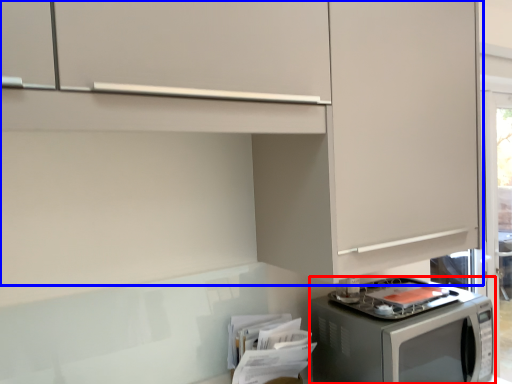
Question: Which object is further to the camera taking this photo, home appliance (highlighted by a red box) or cabinetry (highlighted by a blue box)?

Choices:
 (A) home appliance
 (B) cabinetry

Answer: (A)